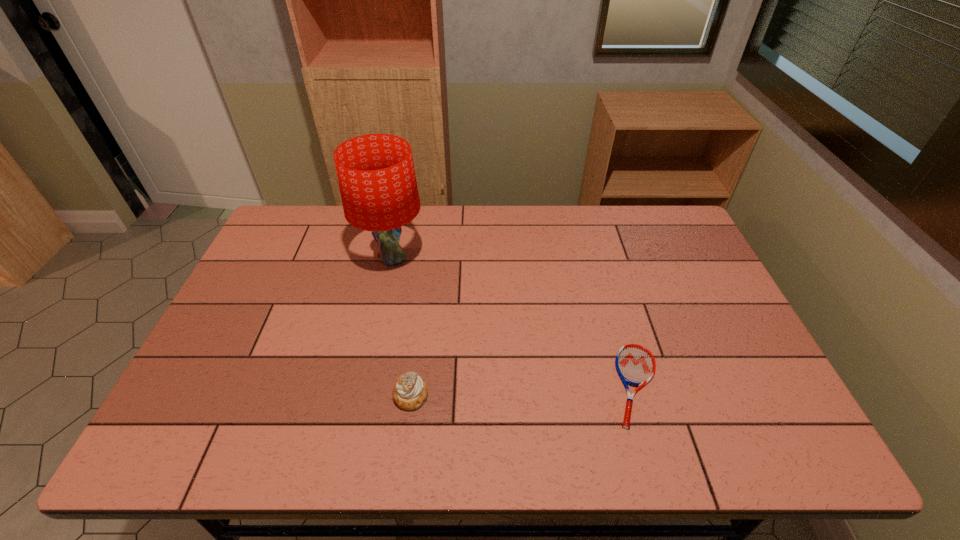
I want to click on free space between the pastry and the shortest object, so click(x=523, y=390).

The height and width of the screenshot is (540, 960). I want to click on free space that is in between the second tallest object and the tallest object, so click(401, 327).

Locate an element on the screen. The image size is (960, 540). vacant space in between the farthest object and the second shortest object is located at coordinates (401, 327).

This screenshot has height=540, width=960. In order to click on free spot between the pastry and the lampshade in this screenshot , I will do `click(401, 327)`.

This screenshot has width=960, height=540. I want to click on the second closest object to the rightmost object, so click(x=376, y=175).

Find the location of a particular element. Image resolution: width=960 pixels, height=540 pixels. object identified as the second closest to the tennis racket is located at coordinates (376, 175).

What are the coordinates of `free space in the image that satisfies the following two spatial constraints: 1. on the back side of the second shortest object; 2. on the right side of the rightmost object` in the screenshot? It's located at (412, 385).

You are a GUI agent. You are given a task and a screenshot of the screen. Output one action in this format:
    pyautogui.click(x=<x>, y=<y>)
    Task: Click on the vacant space that satisfies the following two spatial constraints: 1. on the front-facing side of the lampshade; 2. on the left side of the pastry
    The image size is (960, 540).
    Given the screenshot: What is the action you would take?
    pyautogui.click(x=362, y=395)

Where is `vacant position in the image that satisfies the following two spatial constraints: 1. on the front-facing side of the pastry; 2. on the right side of the lampshade`? The height and width of the screenshot is (540, 960). vacant position in the image that satisfies the following two spatial constraints: 1. on the front-facing side of the pastry; 2. on the right side of the lampshade is located at coordinates (362, 395).

At what (x,y) coordinates should I click in order to perform the action: click on free region that satisfies the following two spatial constraints: 1. on the front-facing side of the farthest object; 2. on the right side of the rightmost object. Please return your answer as a coordinate pair (x, y). Image resolution: width=960 pixels, height=540 pixels. Looking at the image, I should click on (365, 385).